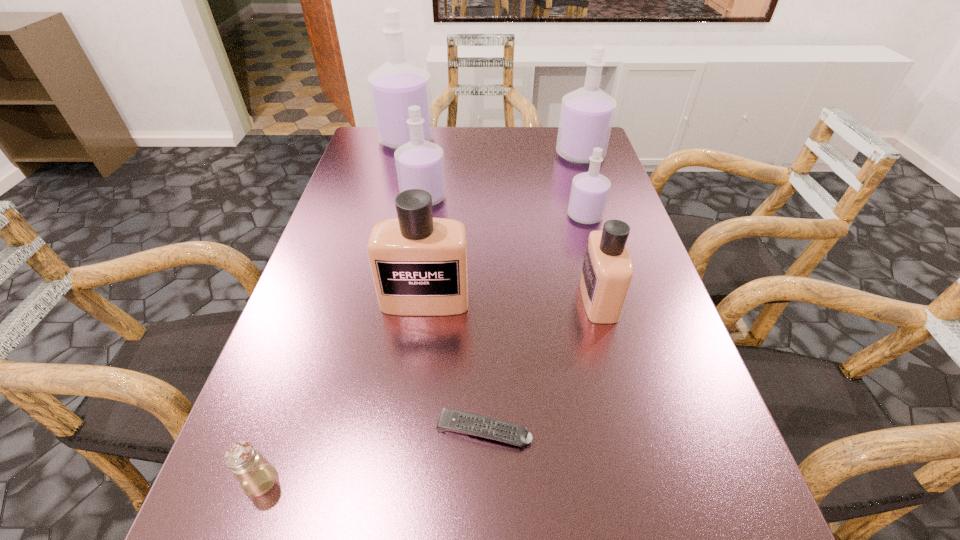
Image resolution: width=960 pixels, height=540 pixels. In order to click on the shortest object in this screenshot , I will do `click(467, 423)`.

Where is `remote control`? The width and height of the screenshot is (960, 540). remote control is located at coordinates (467, 423).

In order to click on free location located on the front of the tallest object in this screenshot , I will do `click(387, 216)`.

You are a GUI agent. You are given a task and a screenshot of the screen. Output one action in this format:
    pyautogui.click(x=<x>, y=<y>)
    Task: Click on the vacant space located on the left of the third smallest purple perfume
    This screenshot has width=960, height=540.
    Given the screenshot: What is the action you would take?
    pyautogui.click(x=477, y=154)

The width and height of the screenshot is (960, 540). In order to click on free space located on the back of the third biggest purple perfume in this screenshot , I will do `click(435, 130)`.

At what (x,y) coordinates should I click in order to perform the action: click on free point located on the front label of the left beige perfume. Please return your answer as a coordinate pair (x, y). Looking at the image, I should click on (413, 406).

The image size is (960, 540). Find the location of `vacant area situated 0.160m on the front label of the smaller beige perfume`. vacant area situated 0.160m on the front label of the smaller beige perfume is located at coordinates (502, 299).

The width and height of the screenshot is (960, 540). Find the location of `vacant space located on the front label of the smaller beige perfume`. vacant space located on the front label of the smaller beige perfume is located at coordinates (496, 299).

Where is `free region located on the front label of the smaller beige perfume`? free region located on the front label of the smaller beige perfume is located at coordinates (487, 299).

This screenshot has width=960, height=540. Identify the location of free space located on the front of the smallest purple perfume. (608, 293).